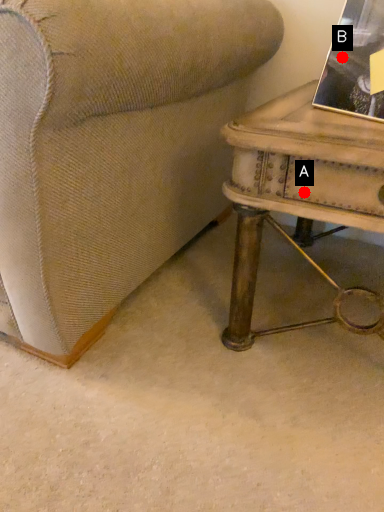
Question: Two points are circled on the image, labeled by A and B beside each circle. Which point is farther from the camera taking this photo?

Choices:
 (A) A is further
 (B) B is further

Answer: (B)